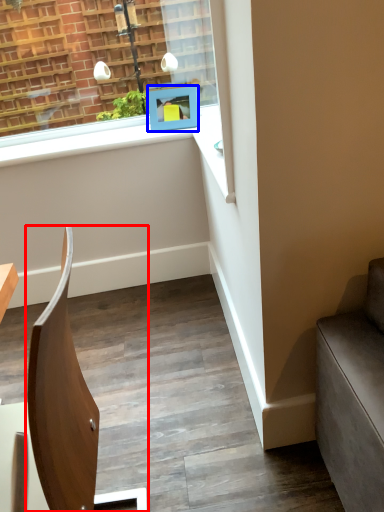
Question: Which point is closer to the camera, chair (highlighted by a red box) or picture frame (highlighted by a blue box)?

Choices:
 (A) chair
 (B) picture frame

Answer: (A)